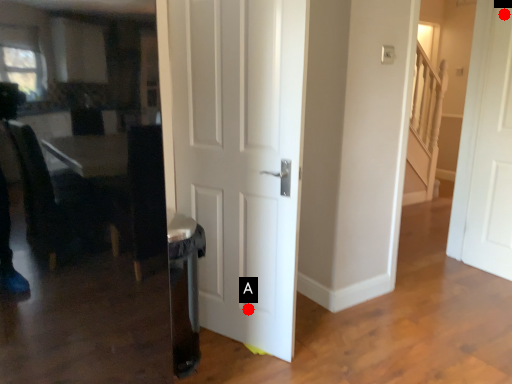
Question: Two points are circled on the image, labeled by A and B beside each circle. Which point is closer to the camera?

Choices:
 (A) A is closer
 (B) B is closer

Answer: (A)